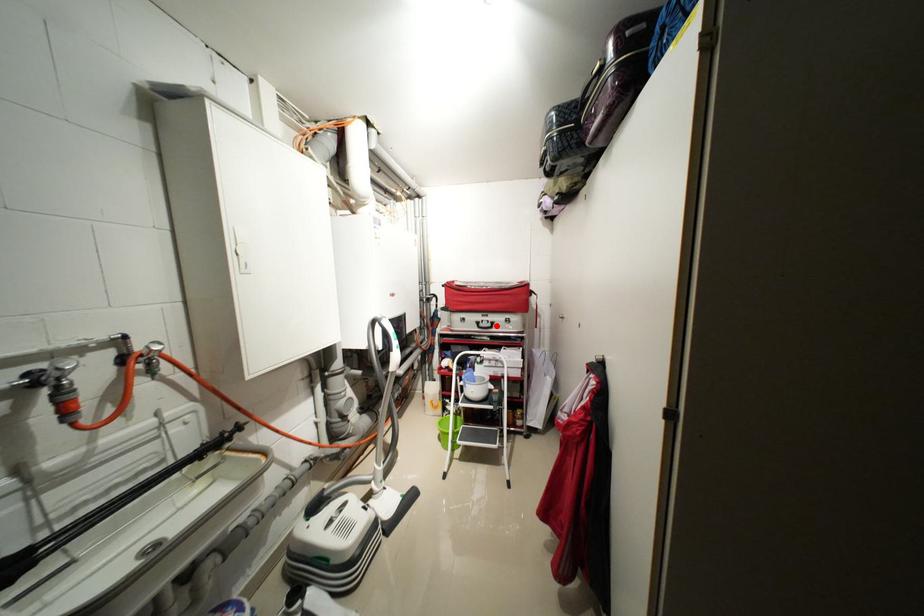
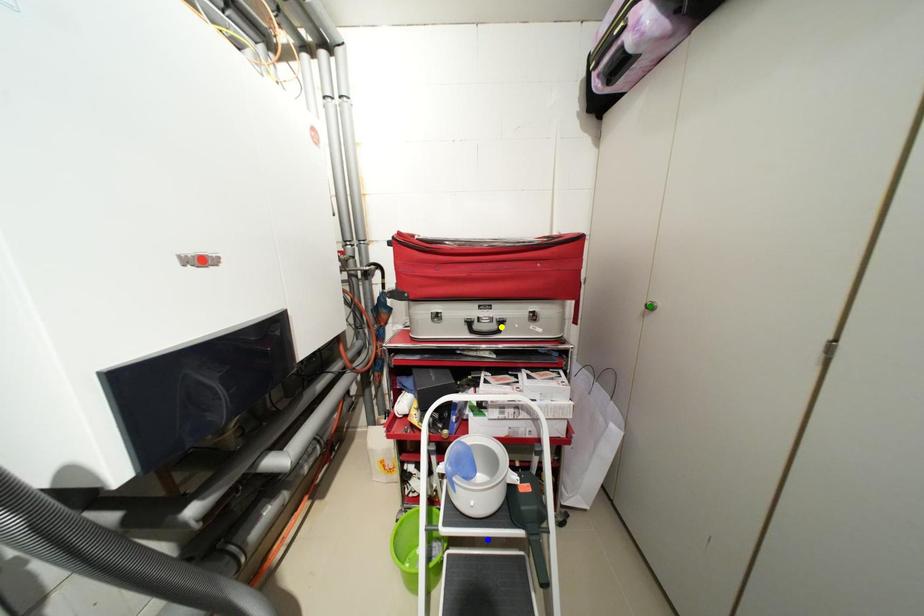
Question: I am providing you with two images of the same scene from different viewpoints. A red point is marked on the first image. You are given multiple points on the second image. Which spot in image 2 lines up with the point in image 1?

Choices:
 (A) yellow point
 (B) green point
 (C) blue point

Answer: (A)